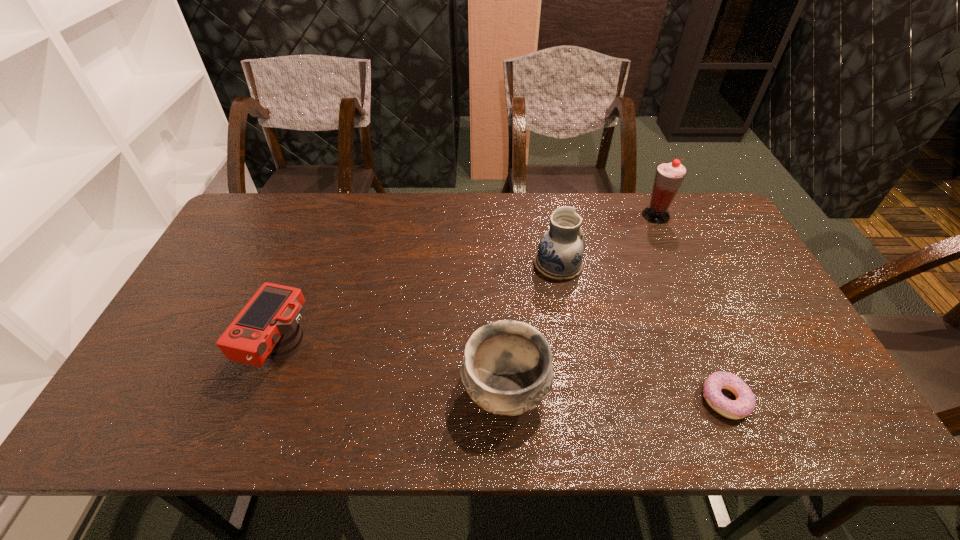
Identify the location of free space located 0.310m on the left of the left pottery. This screenshot has width=960, height=540. (330, 391).

This screenshot has height=540, width=960. I want to click on free spot located 0.240m on the left of the camera, so click(156, 350).

At what (x,y) coordinates should I click in order to perform the action: click on free spot located on the back of the doughnut. Please return your answer as a coordinate pair (x, y). Image resolution: width=960 pixels, height=540 pixels. Looking at the image, I should click on (708, 360).

Where is `object present at the far edge`? This screenshot has height=540, width=960. object present at the far edge is located at coordinates (669, 176).

At what (x,y) coordinates should I click in order to perform the action: click on pottery at the near edge. Please return your answer as a coordinate pair (x, y). Looking at the image, I should click on (507, 369).

This screenshot has height=540, width=960. I want to click on doughnut located at the near edge, so click(744, 404).

Find the location of a particular element. The image size is (960, 540). free space at the far edge of the desktop is located at coordinates (586, 220).

Where is `vacant space at the near edge of the desktop`? vacant space at the near edge of the desktop is located at coordinates (398, 437).

This screenshot has width=960, height=540. Identify the location of blank area at the left edge. (219, 266).

Locate an element on the screen. The height and width of the screenshot is (540, 960). vacant space at the right edge of the desktop is located at coordinates click(x=771, y=347).